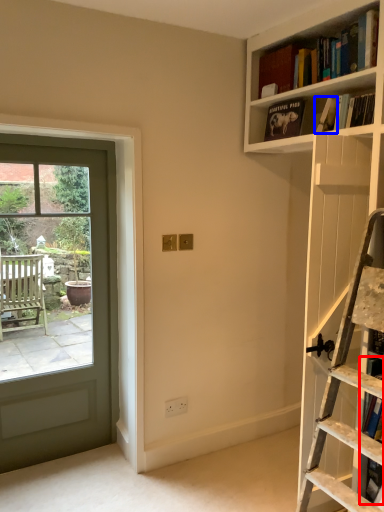
Question: Among these objects, which one is farthest to the camera, book (highlighted by a red box) or book (highlighted by a blue box)?

Choices:
 (A) book
 (B) book

Answer: (B)